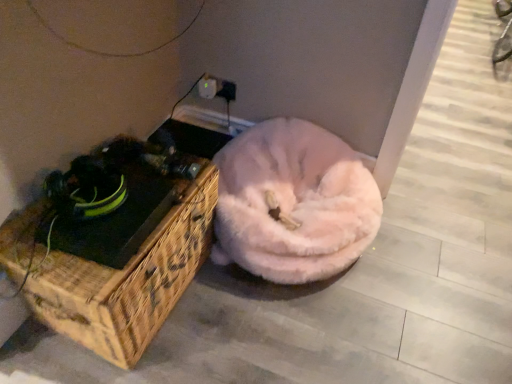
This screenshot has height=384, width=512. In order to click on vacant area that lies to the right of woven wood chest at left in this screenshot , I will do `click(251, 329)`.